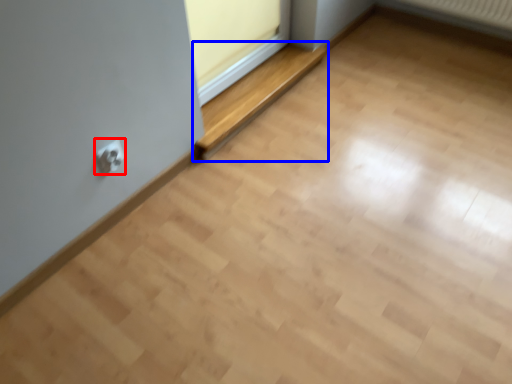
Question: Which of the following is the closest to the observer, electric outlet (highlighted by a red box) or balustrade (highlighted by a blue box)?

Choices:
 (A) electric outlet
 (B) balustrade

Answer: (A)